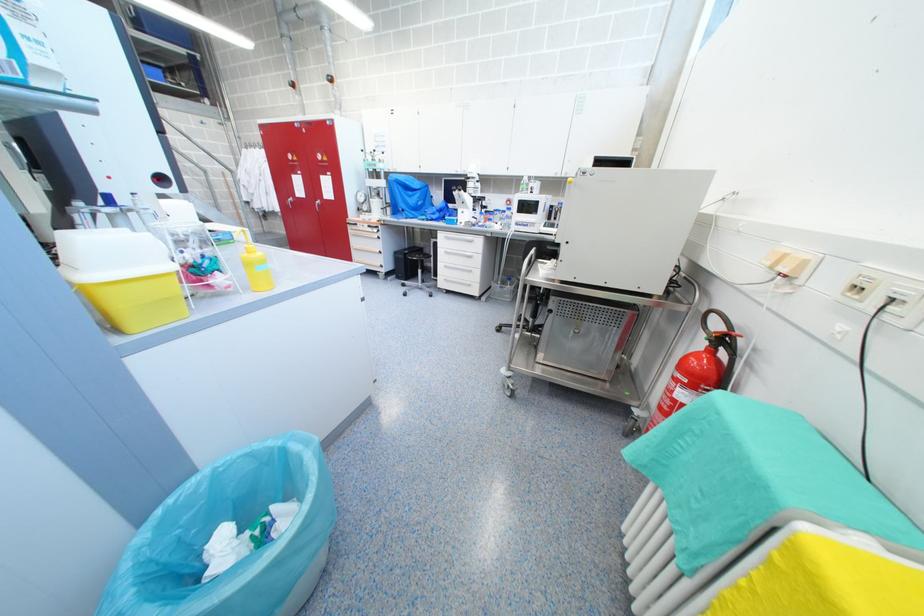
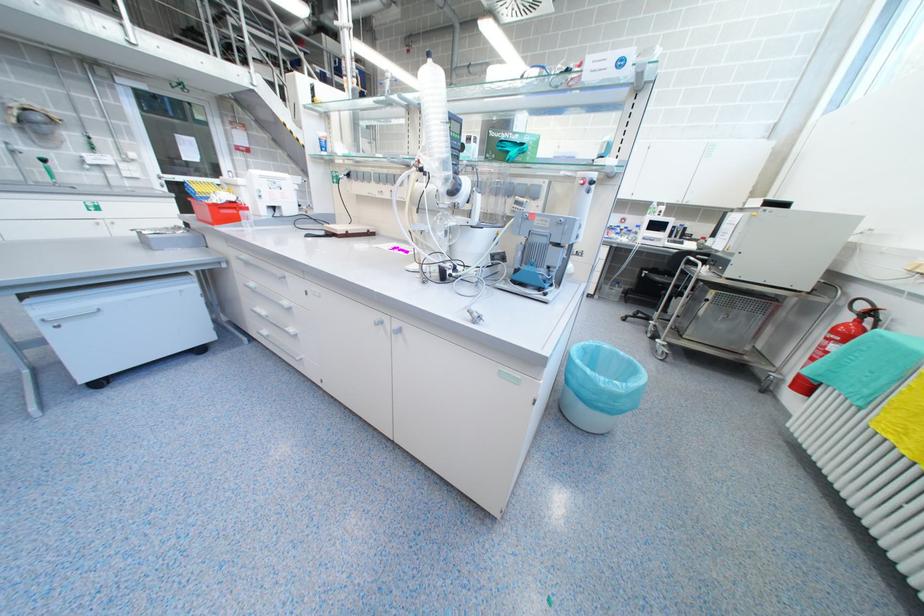
The images are taken continuously from a first-person perspective. In which direction are you moving?

The movement direction of the cameraman is left, backward.